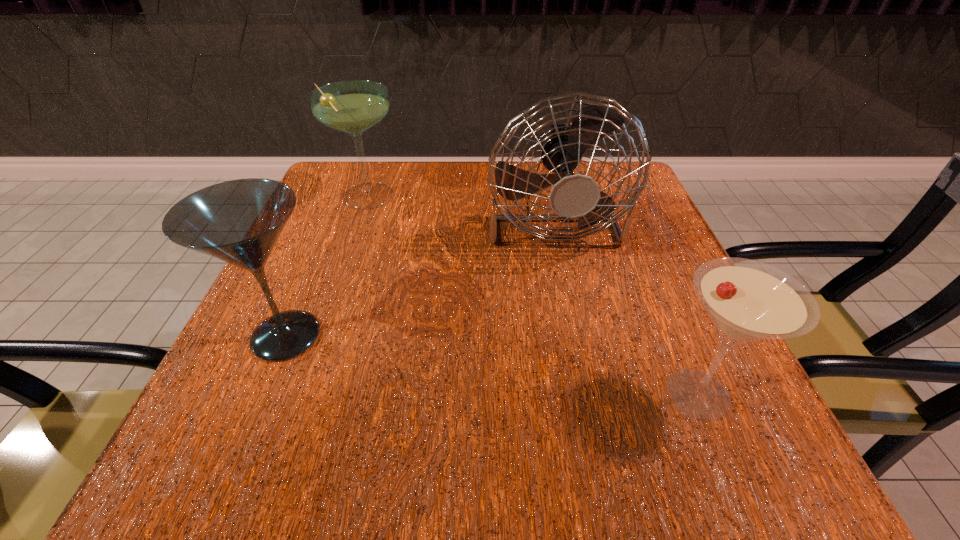
This screenshot has height=540, width=960. What are the coordinates of `object that is the third closest one to the rightmost martini` in the screenshot? It's located at (353, 106).

Identify the location of object that is the closest to the farthest martini. The image size is (960, 540). (574, 197).

Locate an element on the screen. Image resolution: width=960 pixels, height=540 pixels. martini that is the third closest to the tallest object is located at coordinates (239, 221).

Identify which martini is the second closest to the farthest martini. Please provide its 2D coordinates. Your answer should be formatted as a tuple, i.e. [(x, y)], where the tuple contains the x and y coordinates of a point satisfying the conditions above.

[(747, 300)]

This screenshot has width=960, height=540. I want to click on vacant region that satisfies the following two spatial constraints: 1. on the front-facing side of the shortest martini; 2. on the right side of the fan, so click(x=588, y=394).